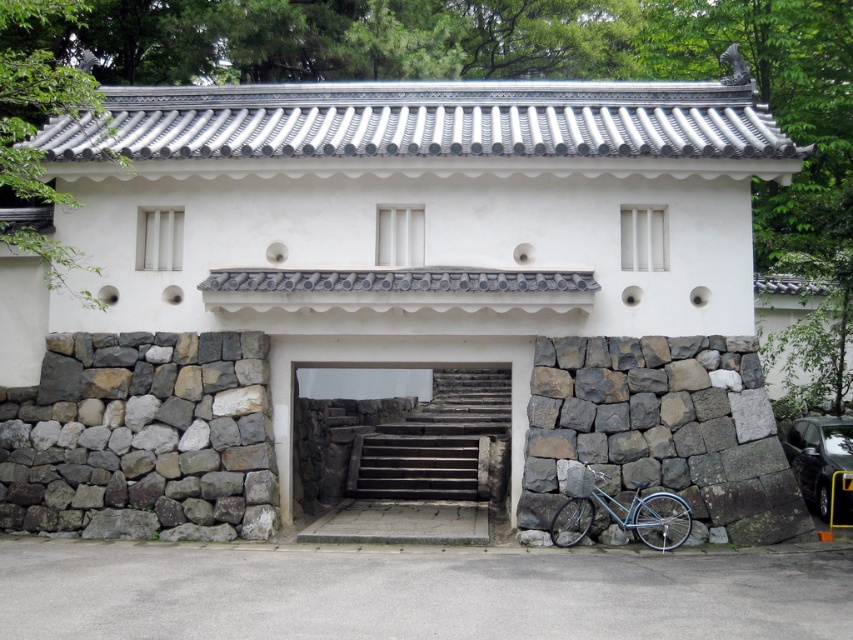
Question: Which point is farther to the camera?

Choices:
 (A) (751, 456)
 (B) (107, 336)

Answer: (B)

Question: Can you confirm if gray rough stone wall at lower left is positioned above stone stairs at center?

Choices:
 (A) no
 (B) yes

Answer: (B)

Question: Which object is positioned farthest from the gray rough stone wall at lower left?

Choices:
 (A) metallic blue bicycle at lower right
 (B) stone stairs at center

Answer: (A)

Question: Which of the following is the farthest from the observer?

Choices:
 (A) stone stairs at center
 (B) gray rough stone wall at lower left
 (C) gray stone wall at lower right
 (D) metallic blue bicycle at lower right

Answer: (A)

Question: Is gray stone wall at lower right thinner than metallic blue bicycle at lower right?

Choices:
 (A) yes
 (B) no

Answer: (B)

Question: Observing the image, what is the correct spatial positioning of gray stone wall at lower right in reference to metallic blue bicycle at lower right?

Choices:
 (A) above
 (B) below

Answer: (A)